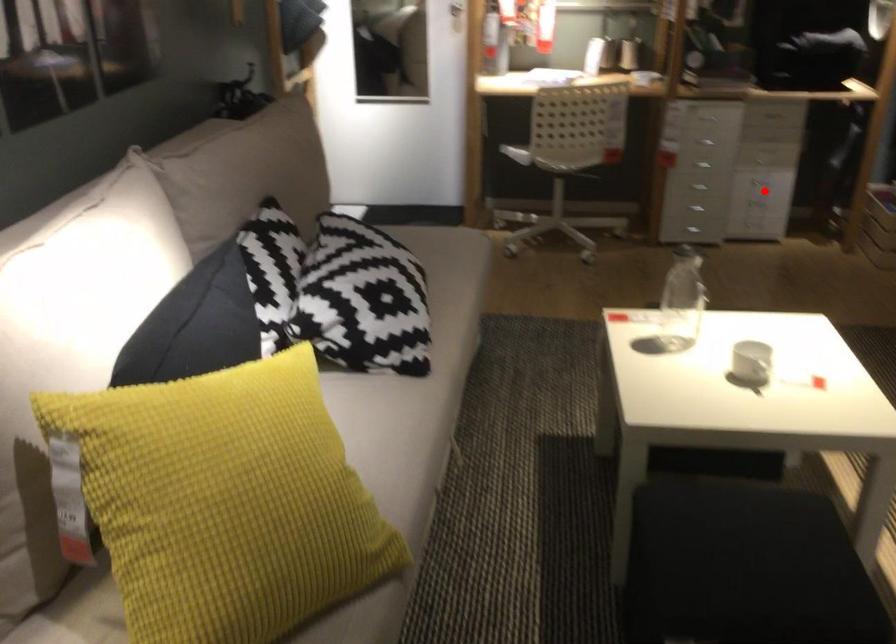
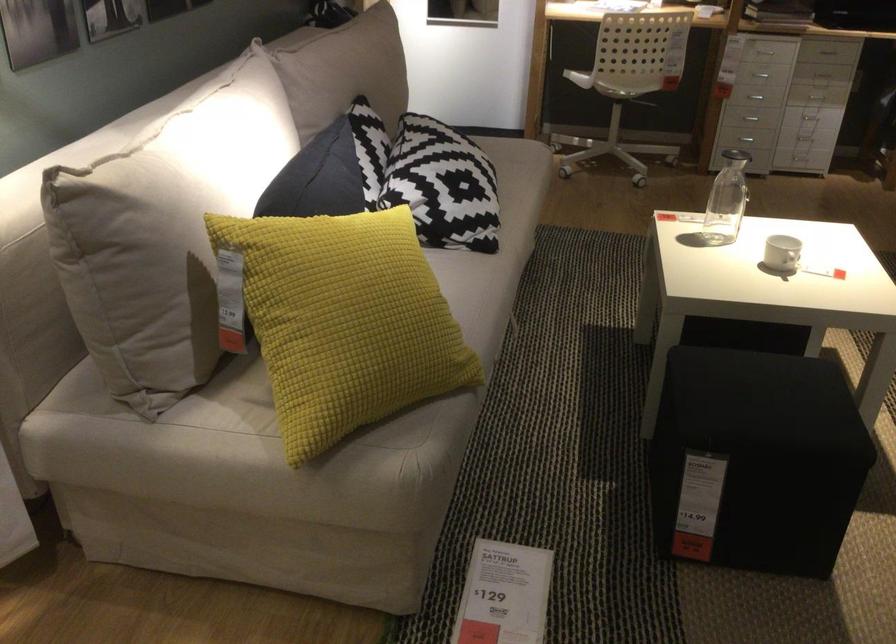
Locate, in the second image, the point that corresponds to the highlighted location in the first image.

(810, 118)